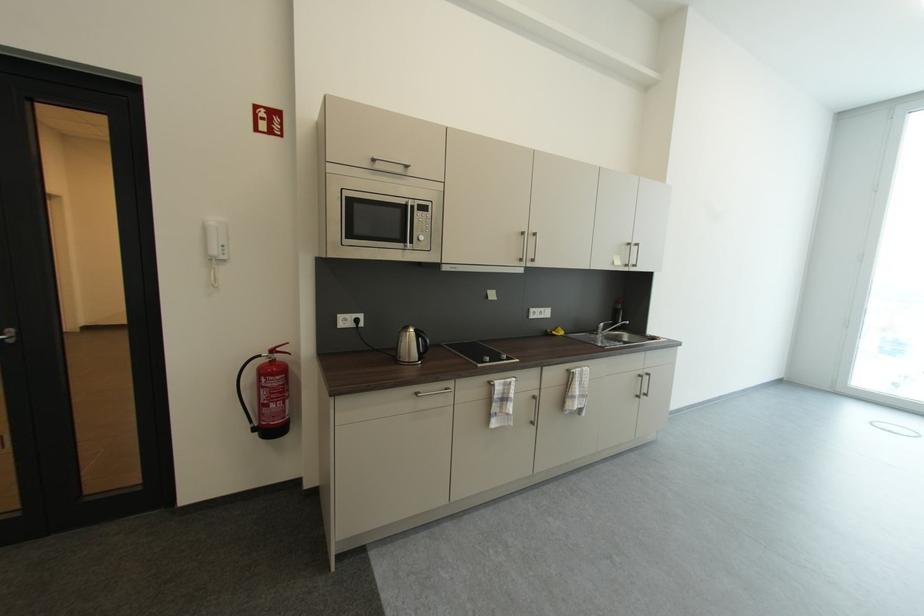
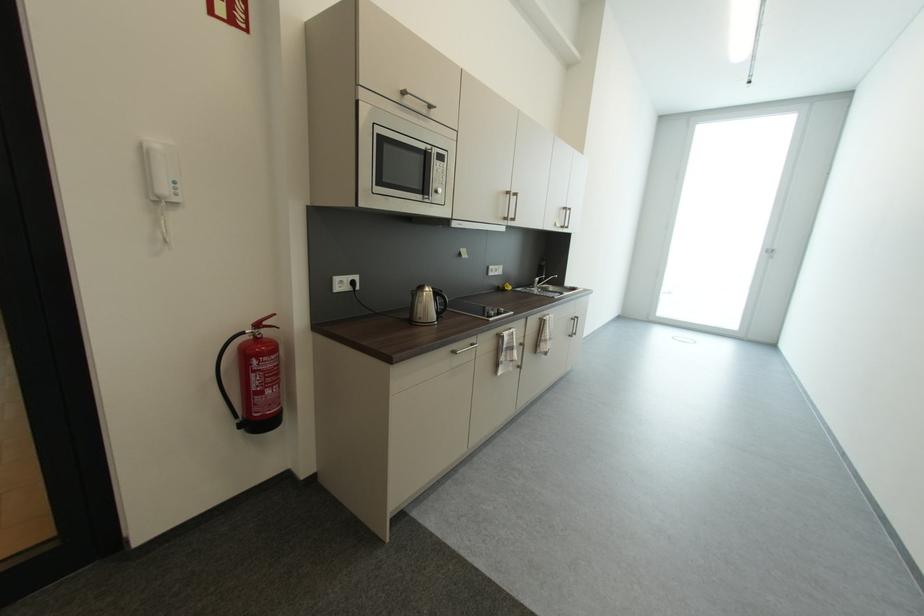
Question: The images are taken continuously from a first-person perspective. In which direction are you moving?

Choices:
 (A) Left
 (B) Right
 (C) Forward
 (D) Backward

Answer: (A)